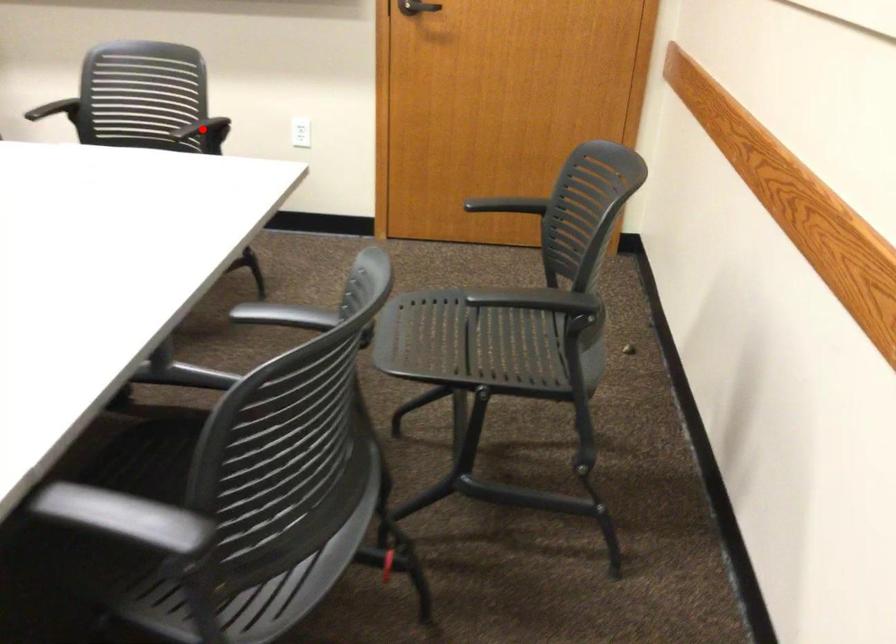
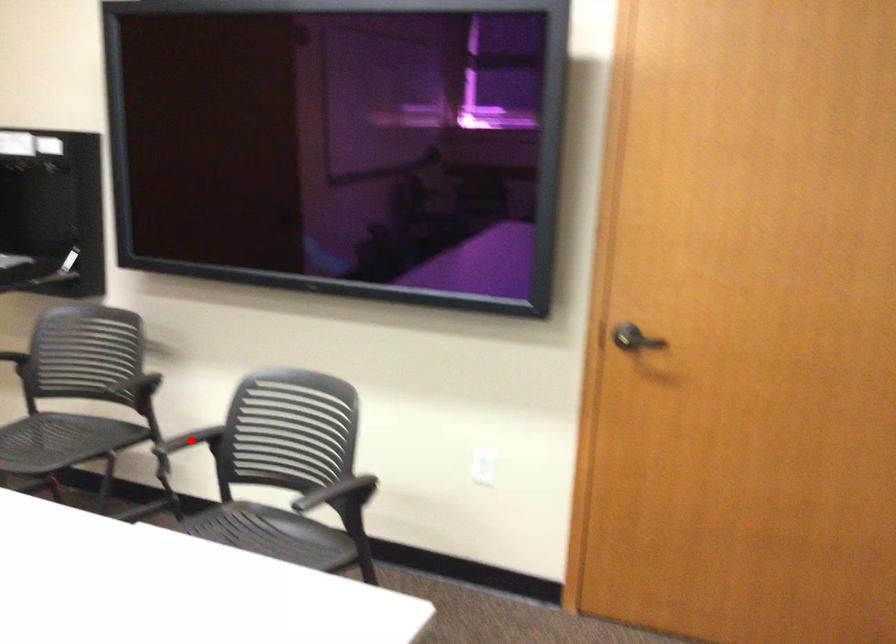
I am providing you with two images of the same scene from different viewpoints. A red point is marked on the first image and another point is marked on the second image. Is the red point in image1 aligned with the point shown in image2?

No